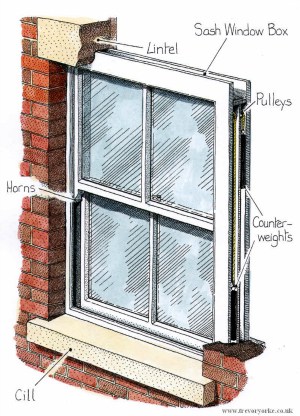
The image size is (300, 416). In order to click on window sill in this screenshot , I will do pos(111,342).